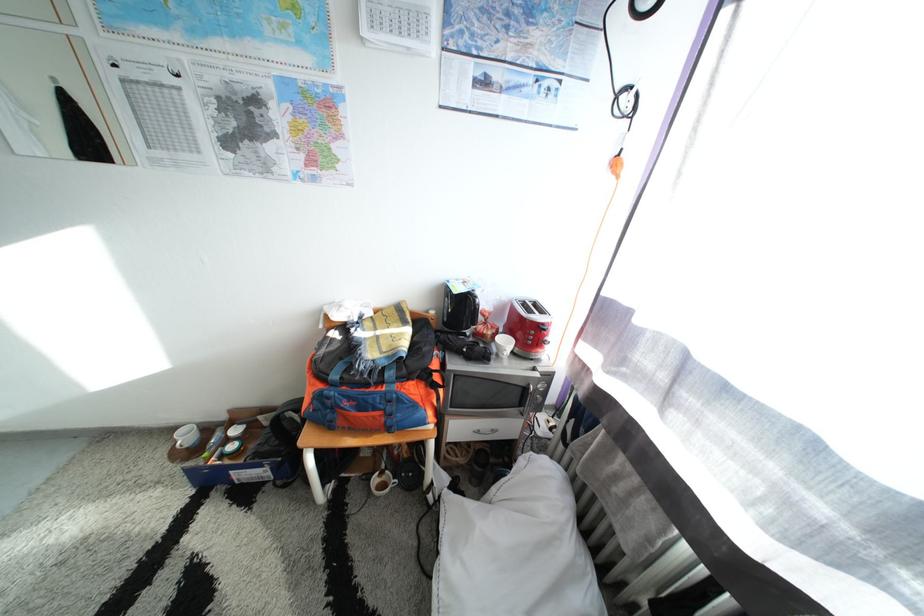
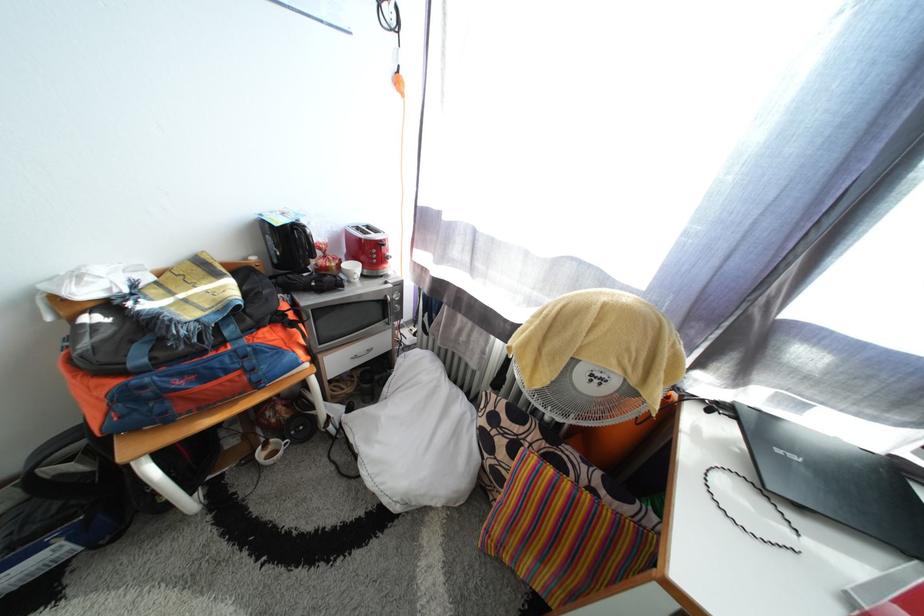
Find the pixel in the second image that matches [531,391] in the first image.

(390, 304)